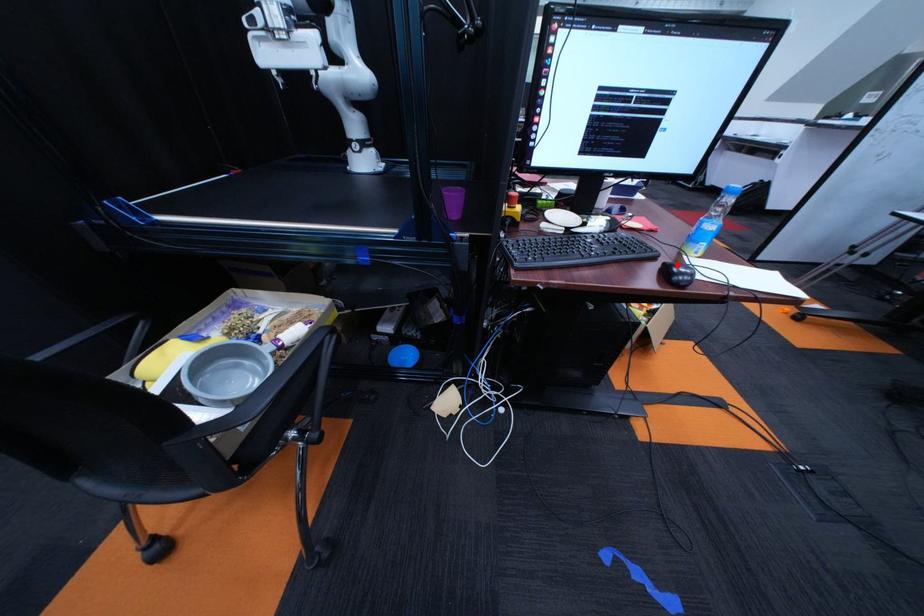
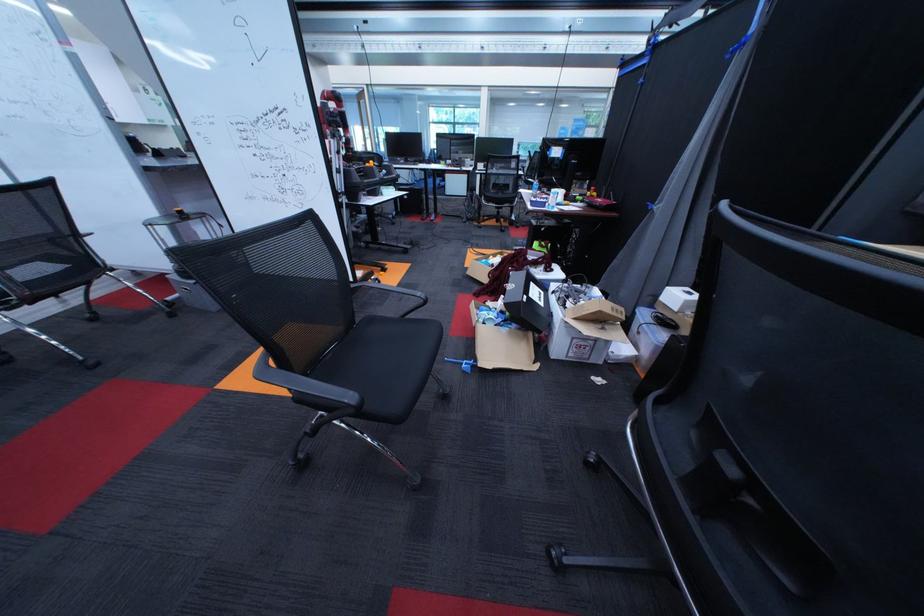
Question: I am providing you with two images of the same scene from different viewpoints. A red point is marked on the first image. Is the red point's position out of view in image 2?

Choices:
 (A) Yes
 (B) No

Answer: (A)